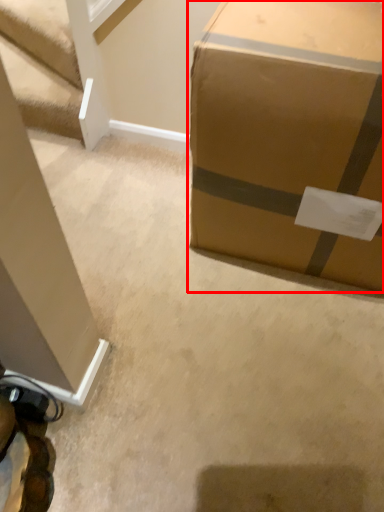
Question: Observing the image, what is the correct spatial positioning of box (annotated by the red box) in reference to stairwell?

Choices:
 (A) left
 (B) right

Answer: (B)